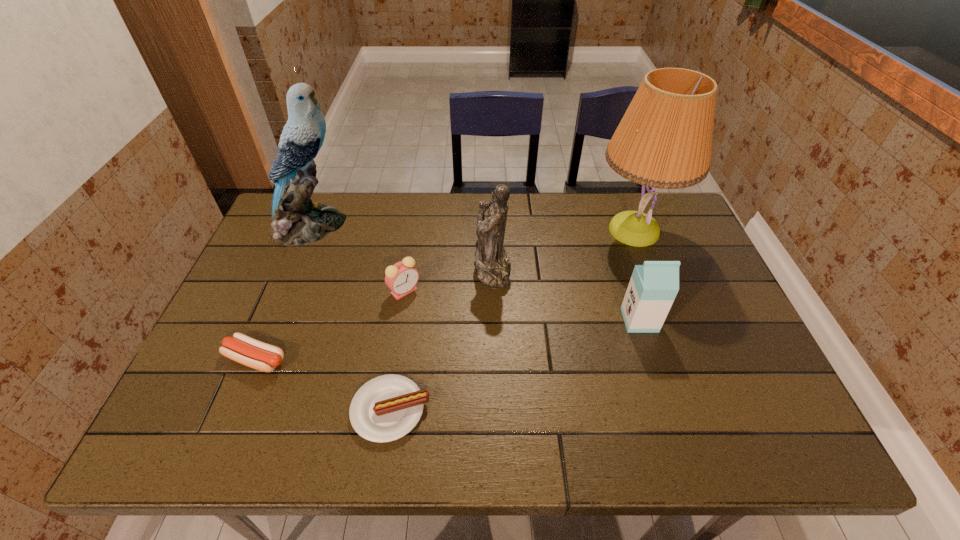
You are a GUI agent. You are given a task and a screenshot of the screen. Output one action in this format:
    pyautogui.click(x=<x>, y=<y>)
    Task: Click on the free point between the parakeet and the shortest object
    
    Given the screenshot: What is the action you would take?
    pyautogui.click(x=350, y=318)

This screenshot has height=540, width=960. What are the coordinates of `vacant area that lies between the milk carton and the parakeet` in the screenshot? It's located at (475, 273).

Find the location of a particular element. The width and height of the screenshot is (960, 540). free space between the right sausage and the lamp is located at coordinates (513, 320).

This screenshot has width=960, height=540. I want to click on blank region between the taller sausage and the alarm clock, so click(x=330, y=325).

Locate an element on the screen. Image resolution: width=960 pixels, height=540 pixels. free space between the shorter sausage and the fourth tallest object is located at coordinates (515, 365).

Identify the location of empty space between the fourth shortest object and the fifth shortest object. (566, 294).

Identify which object is located as the fifth nearest to the milk carton. Please provide its 2D coordinates. Your answer should be formatted as a tuple, i.e. [(x, y)], where the tuple contains the x and y coordinates of a point satisfying the conditions above.

[(296, 220)]

Identify which object is the fifth closest to the lamp. Please provide its 2D coordinates. Your answer should be formatted as a tuple, i.e. [(x, y)], where the tuple contains the x and y coordinates of a point satisfying the conditions above.

[(296, 220)]

Find the location of `free location that satisfies the following two spatial constraints: 1. on the face of the fifth tallest object; 2. on the right side of the fourth shortest object`. free location that satisfies the following two spatial constraints: 1. on the face of the fifth tallest object; 2. on the right side of the fourth shortest object is located at coordinates (399, 320).

The width and height of the screenshot is (960, 540). I want to click on vacant region that satisfies the following two spatial constraints: 1. on the front-facing side of the milk carton; 2. on the left side of the fifth object from left to right, so click(x=494, y=320).